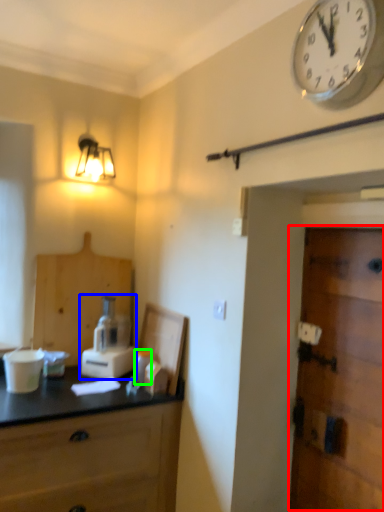
Question: Estimate the real-world distances between objects in this image. Which object is farther from door (highlighted by a red box), blender (highlighted by a blue box) or toiletry (highlighted by a green box)?

Choices:
 (A) blender
 (B) toiletry

Answer: (A)